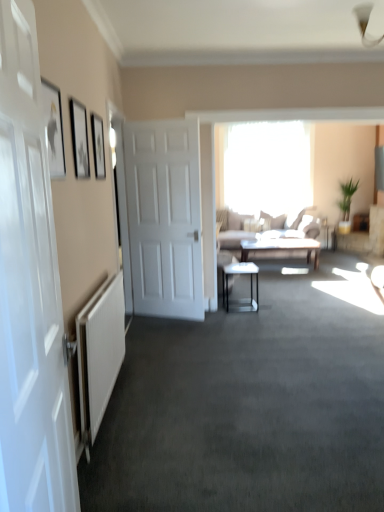
Question: Considering the relative positions of metallic glass table at center, positioned as the 1th table in front-to-back order, and white glossy door at left, the first door from the front, in the image provided, is metallic glass table at center, positioned as the 1th table in front-to-back order, to the right of white glossy door at left, the first door from the front, from the viewer's perspective?

Choices:
 (A) no
 (B) yes

Answer: (B)

Question: Is white glossy door at left, placed as the second door when sorted from back to front, completely or partially inside metallic glass table at center, the second table in the top-to-bottom sequence?

Choices:
 (A) no
 (B) yes

Answer: (A)

Question: From the image's perspective, would you say metallic glass table at center, which appears as the 1th table when viewed from the left, is shown under white glossy door at left, the first door from the front?

Choices:
 (A) no
 (B) yes

Answer: (B)

Question: Is the depth of metallic glass table at center, arranged as the 2th table when viewed from the back, greater than that of white glossy door at left, placed as the second door when sorted from back to front?

Choices:
 (A) yes
 (B) no

Answer: (A)

Question: Can you confirm if metallic glass table at center, arranged as the 2th table when viewed from the back, is positioned to the left of white glossy door at left, the first door from the front?

Choices:
 (A) yes
 (B) no

Answer: (B)

Question: Looking at their shapes, would you say matte gray table at center, the second table positioned from the left, is wider or thinner than matte black picture frame at upper left, which appears as the 2th picture frame when viewed from the front?

Choices:
 (A) thin
 (B) wide

Answer: (B)

Question: Is matte gray table at center, marked as the 1th table in a back-to-front arrangement, in front of or behind matte black picture frame at upper left, which appears as the 2th picture frame when viewed from the front, in the image?

Choices:
 (A) behind
 (B) front

Answer: (A)

Question: From a real-world perspective, is matte gray table at center, the 2th table when ordered from front to back, physically located above or below matte black picture frame at upper left, which appears as the 2th picture frame when viewed from the front?

Choices:
 (A) below
 (B) above

Answer: (A)

Question: From the image's perspective, is matte gray table at center, marked as the first table in a right-to-left arrangement, positioned above or below matte black picture frame at upper left, which appears as the 2th picture frame when viewed from the front?

Choices:
 (A) below
 (B) above

Answer: (A)

Question: Is matte black picture frame at upper left, which ranks as the 1th picture frame in front-to-back order, in front of or behind metallic glass table at center, positioned as the 1th table in front-to-back order, in the image?

Choices:
 (A) front
 (B) behind

Answer: (A)

Question: In terms of width, does matte black picture frame at upper left, the third picture frame viewed from the back, look wider or thinner when compared to metallic glass table at center, which appears as the first table when ordered from the bottom?

Choices:
 (A) wide
 (B) thin

Answer: (B)

Question: From a real-world perspective, is matte black picture frame at upper left, the third picture frame viewed from the back, above or below metallic glass table at center, positioned as the 1th table in front-to-back order?

Choices:
 (A) below
 (B) above

Answer: (B)

Question: Is point (51, 121) closer or farther from the camera than point (238, 266)?

Choices:
 (A) farther
 (B) closer

Answer: (B)

Question: From a real-world perspective, is light brown fabric couch at center physically located above or below matte gray table at center, marked as the 1th table in a back-to-front arrangement?

Choices:
 (A) above
 (B) below

Answer: (A)

Question: Is light brown fabric couch at center spatially inside matte gray table at center, the second table positioned from the left, or outside of it?

Choices:
 (A) inside
 (B) outside

Answer: (B)